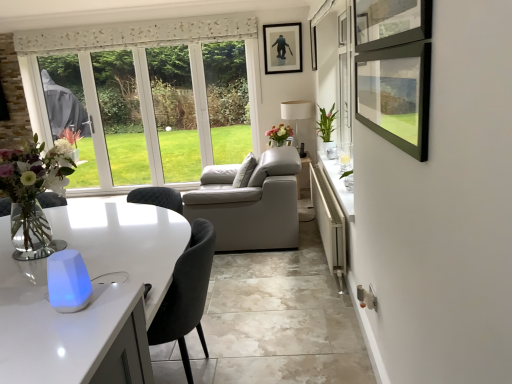
Measure the distance between green glossy vase at upper right, the first flower when ordered from right to left, and camera.

The depth of green glossy vase at upper right, the first flower when ordered from right to left, is 4.59 meters.

Find the location of `matte black picture frame at upper center`. matte black picture frame at upper center is located at coordinates (282, 48).

Describe the element at coordinates (282, 48) in the screenshot. The height and width of the screenshot is (384, 512). I see `matte black picture frame at upper center` at that location.

What do you see at coordinates (279, 133) in the screenshot? The width and height of the screenshot is (512, 384). I see `translucent glass vase at center, placed as the 2th flower when sorted from right to left` at bounding box center [279, 133].

Measure the distance between white matte lamp at center and camera.

white matte lamp at center and camera are 5.59 meters apart from each other.

Find the location of a particular element. This screenshot has height=384, width=512. green glossy vase at upper right, placed as the first flower when sorted from front to back is located at coordinates (326, 123).

From a real-world perspective, who is located lower, white matte lamp at center or green glossy vase at upper right, the second flower positioned from the left?

From a 3D spatial view, white matte lamp at center is below.

Is white matte lamp at center looking in the opposite direction of green glossy vase at upper right, the 2th flower in the back-to-front sequence?

No, white matte lamp at center is not facing the opposite direction of green glossy vase at upper right, the 2th flower in the back-to-front sequence.

I want to click on the 2nd flower in front of the white matte lamp at center, so click(x=326, y=123).

Can you confirm if white matte lamp at center is thinner than green glossy vase at upper right, placed as the first flower when sorted from front to back?

Incorrect, the width of white matte lamp at center is not less than that of green glossy vase at upper right, placed as the first flower when sorted from front to back.

Between translucent glass vase at center, which appears as the first flower when viewed from the left, and green glossy vase at upper right, the 2th flower in the back-to-front sequence, which one has larger width?

Wider between the two is translucent glass vase at center, which appears as the first flower when viewed from the left.

Considering the relative sizes of translucent glass vase at center, which ranks as the first flower in back-to-front order, and green glossy vase at upper right, the first flower when ordered from right to left, in the image provided, is translucent glass vase at center, which ranks as the first flower in back-to-front order, shorter than green glossy vase at upper right, the first flower when ordered from right to left,?

Indeed, translucent glass vase at center, which ranks as the first flower in back-to-front order, has a lesser height compared to green glossy vase at upper right, the first flower when ordered from right to left.

Is translucent glass vase at center, placed as the 2th flower when sorted from right to left, facing towards green glossy vase at upper right, the 2th flower in the back-to-front sequence?

No, translucent glass vase at center, placed as the 2th flower when sorted from right to left, is not turned towards green glossy vase at upper right, the 2th flower in the back-to-front sequence.

Which object is more forward, translucent glass vase at left or white matte lamp at center?

translucent glass vase at left is more forward.

Is translucent glass vase at left not inside white matte lamp at center?

translucent glass vase at left lies outside white matte lamp at center's area.

From a real-world perspective, who is located lower, translucent glass vase at left or white matte lamp at center?

In real-world perspective, white matte lamp at center is lower.

From the image's perspective, is translucent glass vase at left under white matte lamp at center?

Yes.

Consider the image. Is white glossy counter at lower right completely or partially outside of matte black picture frame at upper center?

Indeed, white glossy counter at lower right is completely outside matte black picture frame at upper center.

Measure the distance from white glossy counter at lower right to matte black picture frame at upper center.

The distance of white glossy counter at lower right from matte black picture frame at upper center is 2.09 meters.

Can you confirm if white glossy counter at lower right is thinner than matte black picture frame at upper center?

Incorrect, the width of white glossy counter at lower right is not less than that of matte black picture frame at upper center.

Considering the positions of points (342, 224) and (285, 29), is point (342, 224) closer to camera compared to point (285, 29)?

That is True.

Which is in front, green glossy vase at upper right, placed as the first flower when sorted from front to back, or translucent glass vase at center, placed as the 2th flower when sorted from right to left?

green glossy vase at upper right, placed as the first flower when sorted from front to back, is more forward.

From the image's perspective, is green glossy vase at upper right, placed as the first flower when sorted from front to back, above translucent glass vase at center, which ranks as the first flower in back-to-front order?

Indeed, from the image's perspective, green glossy vase at upper right, placed as the first flower when sorted from front to back, is shown above translucent glass vase at center, which ranks as the first flower in back-to-front order.

How many degrees apart are the facing directions of green glossy vase at upper right, the first flower when ordered from right to left, and translucent glass vase at center, placed as the 2th flower when sorted from right to left?

The angular difference between green glossy vase at upper right, the first flower when ordered from right to left, and translucent glass vase at center, placed as the 2th flower when sorted from right to left, is 0.000573 degrees.

Is point (330, 135) closer or farther from the camera than point (279, 134)?

Point (330, 135) is closer to the camera than point (279, 134).

Identify the location of picture frame above the translucent glass vase at left (from the image's perspective). (282, 48).

Between translucent glass vase at left and matte black picture frame at upper center, which one is positioned in front?

translucent glass vase at left is more forward.

Is the surface of translucent glass vase at left in direct contact with matte black picture frame at upper center?

No, translucent glass vase at left is not next to matte black picture frame at upper center.

Which is more to the right, translucent glass vase at left or matte black picture frame at upper center?

matte black picture frame at upper center is more to the right.

This screenshot has width=512, height=384. What are the coordinates of `counter in front of the translucent glass vase at center, which is counted as the 2th flower, starting from the front` in the screenshot? It's located at (329, 223).

Which object is more forward, white glossy counter at lower right or translucent glass vase at center, which is counted as the 2th flower, starting from the front?

white glossy counter at lower right is closer to the camera.

Is white glossy counter at lower right at the right side of translucent glass vase at center, which ranks as the first flower in back-to-front order?

Indeed, white glossy counter at lower right is positioned on the right side of translucent glass vase at center, which ranks as the first flower in back-to-front order.

From the image's perspective, is white glossy counter at lower right under translucent glass vase at center, which ranks as the first flower in back-to-front order?

Indeed, from the image's perspective, white glossy counter at lower right is shown beneath translucent glass vase at center, which ranks as the first flower in back-to-front order.

Where is `lamp behind the green glossy vase at upper right, the 2th flower in the back-to-front sequence`? This screenshot has height=384, width=512. lamp behind the green glossy vase at upper right, the 2th flower in the back-to-front sequence is located at coordinates (296, 113).

At what (x,y) coordinates should I click in order to perform the action: click on flower below the green glossy vase at upper right, the 2th flower in the back-to-front sequence (from the image's perspective). Please return your answer as a coordinate pair (x, y). This screenshot has width=512, height=384. Looking at the image, I should click on (279, 133).

Considering their positions, is matte black picture frame at upper center positioned closer to white matte lamp at center than translucent glass vase at center, which ranks as the first flower in back-to-front order?

Among the two, translucent glass vase at center, which ranks as the first flower in back-to-front order, is located nearer to white matte lamp at center.

Considering their positions, is translucent glass vase at center, which ranks as the first flower in back-to-front order, positioned further to matte black picture frame at upper center than white matte lamp at center?

Based on the image, translucent glass vase at center, which ranks as the first flower in back-to-front order, appears to be further to matte black picture frame at upper center.

Based on the photo, looking at the image, which one is located closer to white glossy counter at lower right, translucent glass vase at left or green glossy vase at upper right, the first flower when ordered from right to left?

green glossy vase at upper right, the first flower when ordered from right to left.

Based on their spatial positions, is matte black picture frame at upper center or green glossy vase at upper right, the second flower positioned from the left, closer to translucent glass vase at center, which is counted as the 2th flower, starting from the front?

Based on the image, green glossy vase at upper right, the second flower positioned from the left, appears to be nearer to translucent glass vase at center, which is counted as the 2th flower, starting from the front.

From the image, which object appears to be nearer to green glossy vase at upper right, the second flower positioned from the left, translucent glass vase at center, which appears as the first flower when viewed from the left, or translucent glass vase at left?

translucent glass vase at center, which appears as the first flower when viewed from the left, is closer to green glossy vase at upper right, the second flower positioned from the left.

Considering their positions, is translucent glass vase at center, which ranks as the first flower in back-to-front order, positioned closer to green glossy vase at upper right, the first flower when ordered from right to left, than white matte lamp at center?

translucent glass vase at center, which ranks as the first flower in back-to-front order, is closer to green glossy vase at upper right, the first flower when ordered from right to left.

When comparing their distances from green glossy vase at upper right, the first flower when ordered from right to left, does white glossy counter at lower right or translucent glass vase at left seem further?

translucent glass vase at left lies further to green glossy vase at upper right, the first flower when ordered from right to left, than the other object.

From the image, which object appears to be farther from green glossy vase at upper right, the first flower when ordered from right to left, matte black picture frame at upper center or white glossy counter at lower right?

Among the two, white glossy counter at lower right is located further to green glossy vase at upper right, the first flower when ordered from right to left.

I want to click on flower between translucent glass vase at left and translucent glass vase at center, which ranks as the first flower in back-to-front order, in the front-back direction, so click(326, 123).

Identify the location of lamp between white glossy counter at lower right and matte black picture frame at upper center along the z-axis. This screenshot has width=512, height=384. (296, 113).

Locate an element on the screen. The width and height of the screenshot is (512, 384). counter located between translucent glass vase at left and translucent glass vase at center, which is counted as the 2th flower, starting from the front, in the depth direction is located at coordinates (329, 223).

You are a GUI agent. You are given a task and a screenshot of the screen. Output one action in this format:
    pyautogui.click(x=<x>, y=<y>)
    Task: Click on the flower between matte black picture frame at upper center and translucent glass vase at center, which ranks as the first flower in back-to-front order, in the vertical direction
    This screenshot has height=384, width=512.
    Given the screenshot: What is the action you would take?
    coord(326,123)